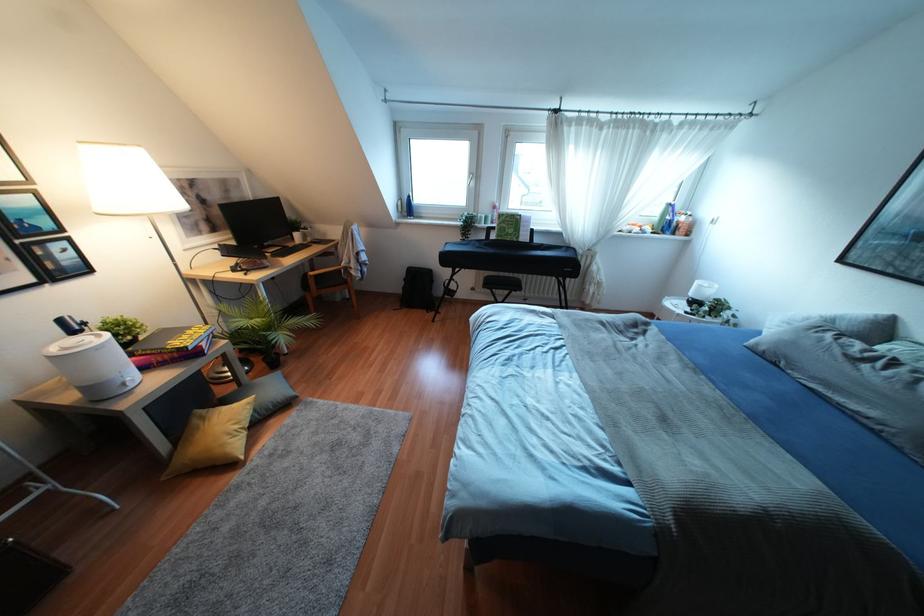
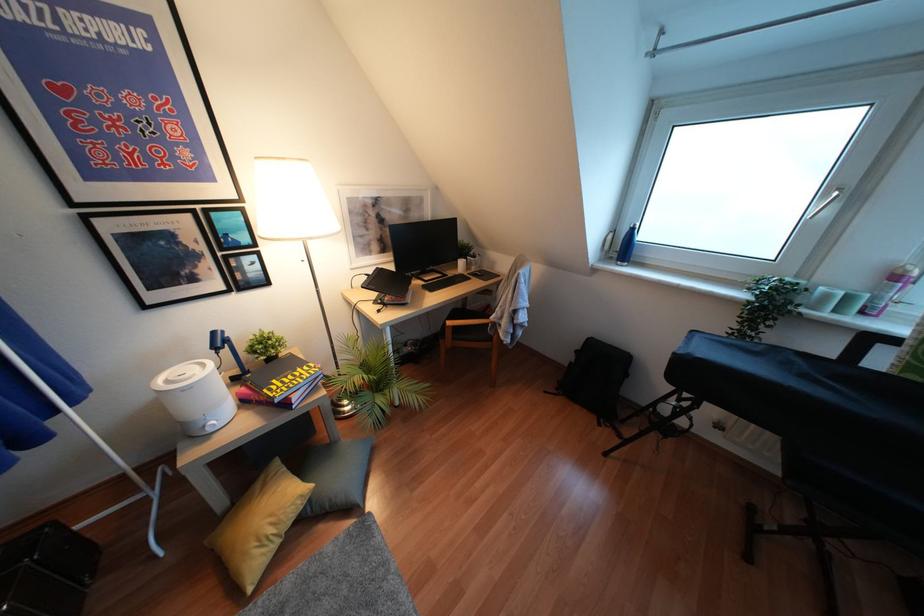
The point at (x=484, y=217) is marked in the first image. Where is the corresponding point in the second image?

(846, 298)